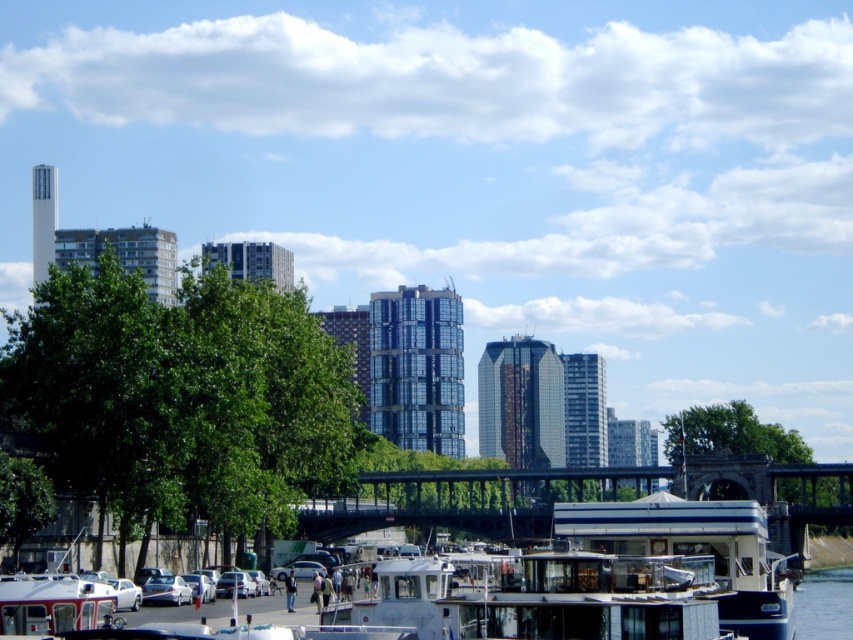
You are standing at the riverside and looking at two points marked in the image. The first point is at coordinates point (541, 620) and the second is at point (734, 513). Which point is nearer to your current position?

Point (541, 620) is closer to the camera than point (734, 513), so the first point is nearer to your current position.

You are standing at the center of the bridge in the midground. Looking down at the riverside area, where is the white glossy houseboat at lower center located relative to your current position?

The white glossy houseboat at lower center is located at the lower center position, which would be directly below and slightly to the center from your current position on the bridge in the midground.

You are a photographer planning to capture the transparent glass cabin at lower center and the white glossy houseboat at lower center from the bridge. Since you want to ensure both are visible in the frame, which object should you position closer to the edge of the bridge to avoid blocking the other?

You should position the transparent glass cabin at lower center closer to the edge of the bridge because it is thinner than the white glossy houseboat at lower center, making it less likely to block the view of the wider houseboat.